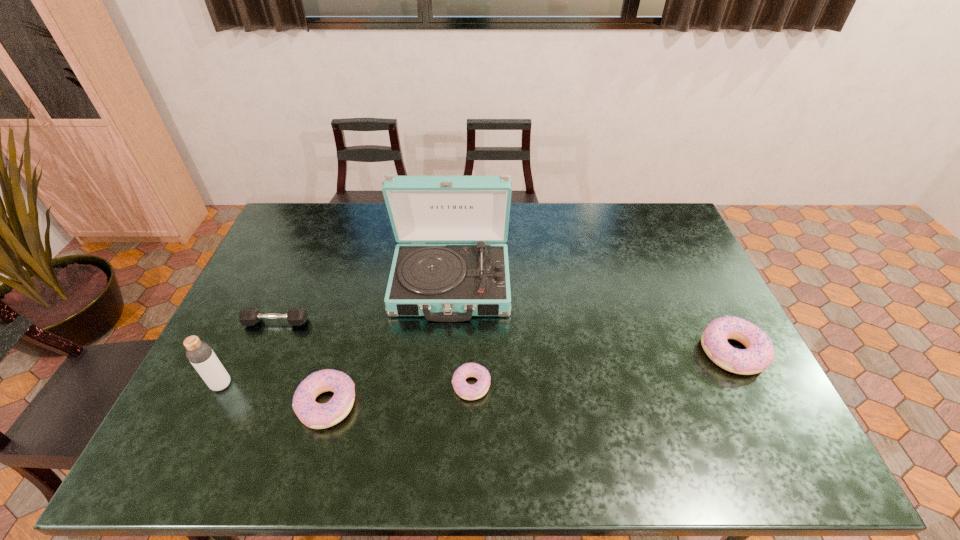
The width and height of the screenshot is (960, 540). In order to click on the second tallest doughnut in this screenshot , I will do `click(314, 415)`.

Identify the location of the third object from left to right. This screenshot has height=540, width=960. (314, 415).

Find the location of a particular element. the shortest object is located at coordinates (464, 390).

The image size is (960, 540). I want to click on the second doughnut from left to right, so click(x=464, y=390).

I want to click on the rightmost doughnut, so click(x=760, y=353).

Where is `dumbbell`? dumbbell is located at coordinates (249, 316).

The image size is (960, 540). Identify the location of the fifth shortest object. (199, 353).

Locate an element on the screen. The width and height of the screenshot is (960, 540). record player is located at coordinates (443, 282).

Where is `free space located on the right of the second tallest doughnut`? The width and height of the screenshot is (960, 540). free space located on the right of the second tallest doughnut is located at coordinates (488, 404).

Image resolution: width=960 pixels, height=540 pixels. What are the coordinates of `vacant region located on the right of the second doughnut from right to left` in the screenshot? It's located at (583, 385).